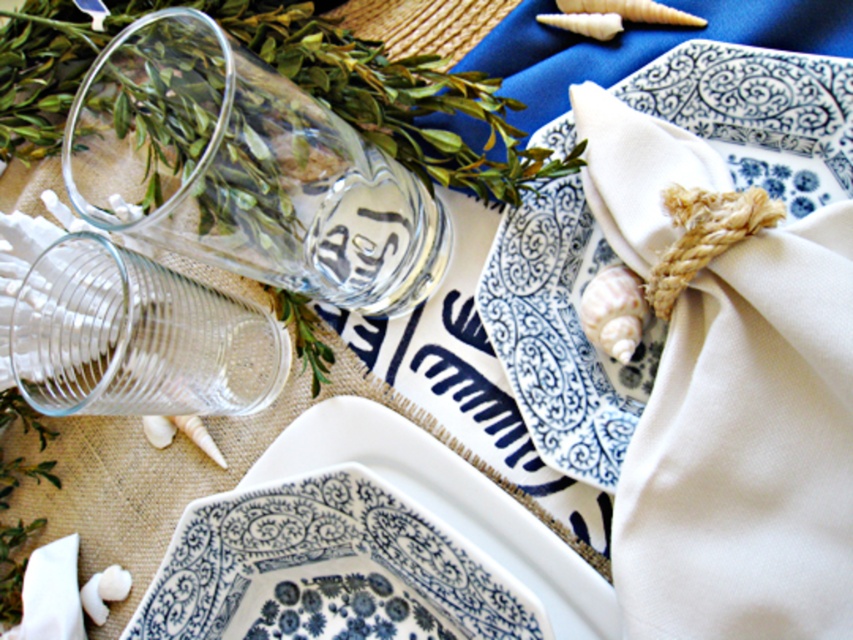
Is point (782, 84) farther from camera compared to point (329, 636)?

No, it is in front of (329, 636).

Who is positioned more to the right, blue and white ceramic plate at upper right or blue and white ceramic platter at center?

blue and white ceramic plate at upper right is more to the right.

This screenshot has height=640, width=853. Identify the location of blue and white ceramic plate at upper right. point(561,333).